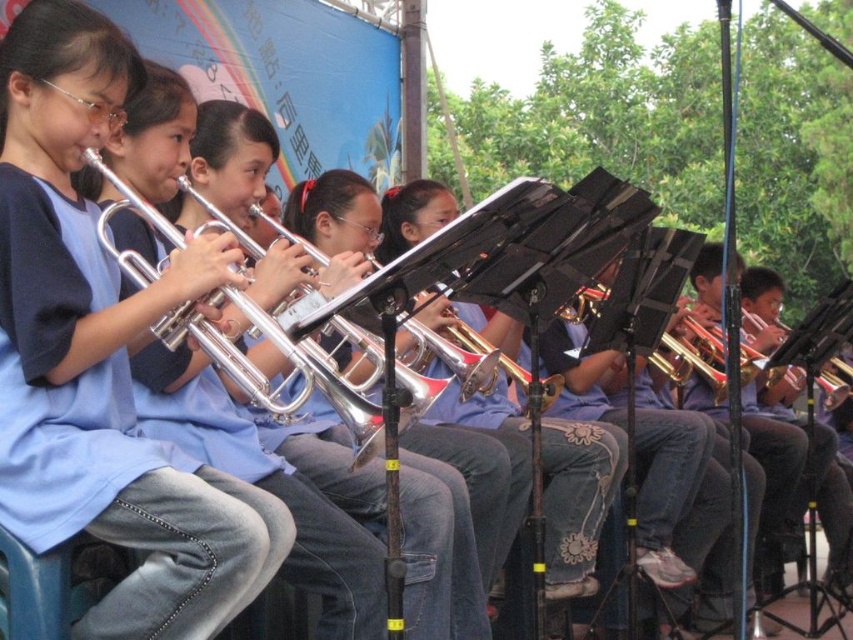
You are a photographer at the event and want to capture a photo of both the silver shiny trumpet at center and the brushed metal trumpet at center. Which trumpet should you focus on first if you want to include both in your frame without moving the camera?

You should focus on the silver shiny trumpet at center first because it is positioned above the brushed metal trumpet at center, making it easier to include both in the frame by adjusting the camera angle slightly upward.

You are a photographer trying to capture the perfect shot of the matte silver trumpet at center. You know that the best angle is directly in front of the trumpet. Based on the coordinates provided, where should you position yourself relative to the trumpet?

The matte silver trumpet at center is located at coordinates point [334,518]. To capture the best angle directly in front, position yourself facing the trumpet at those coordinates.